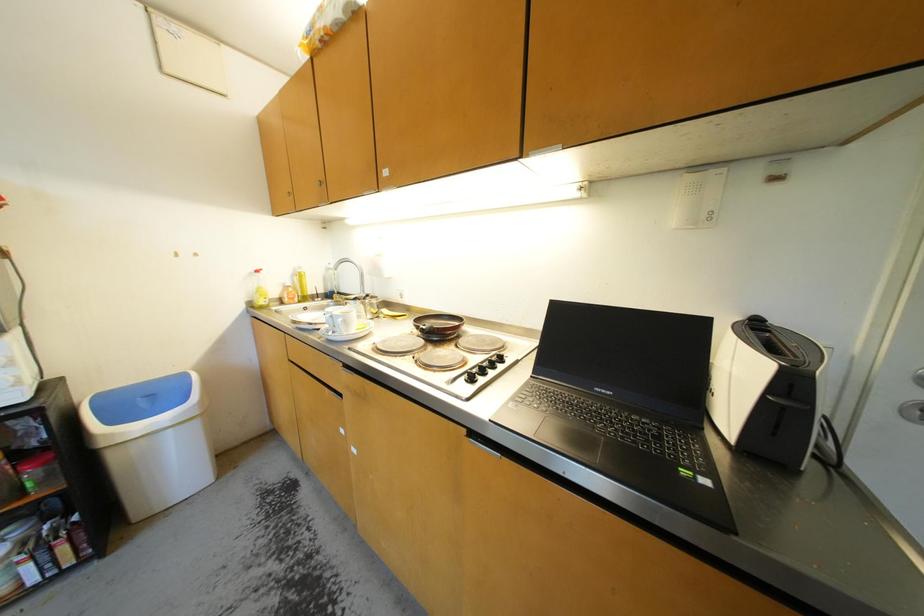
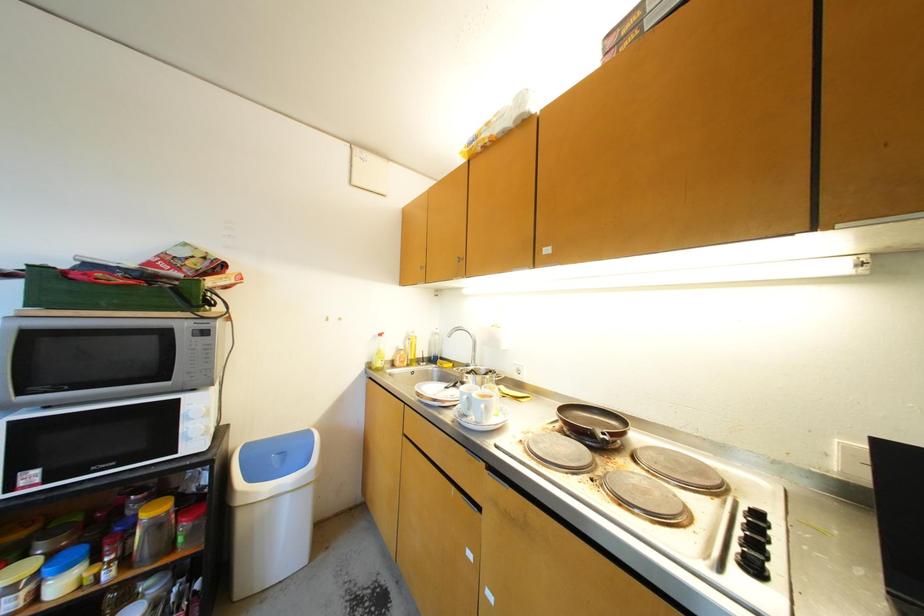
Question: The images are taken continuously from a first-person perspective. In which direction are you moving?

Choices:
 (A) Left
 (B) Right
 (C) Forward
 (D) Backward

Answer: (A)